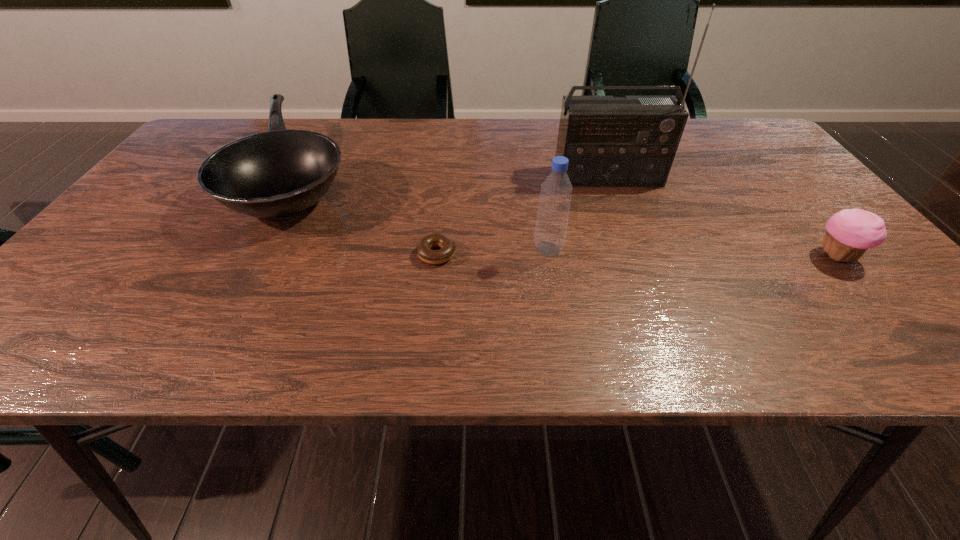
Identify which object is the third nearest to the third object from right to left. Please provide its 2D coordinates. Your answer should be formatted as a tuple, i.e. [(x, y)], where the tuple contains the x and y coordinates of a point satisfying the conditions above.

[(280, 173)]

Identify the location of free spot that satisfies the following two spatial constraints: 1. on the front side of the cupcake; 2. on the left side of the doughnut. (436, 256).

Identify the location of vacant space that satisfies the following two spatial constraints: 1. on the front side of the leftmost object; 2. on the left side of the rightmost object. (256, 256).

What are the coordinates of `free location that satisfies the following two spatial constraints: 1. on the front side of the leftmost object; 2. on the right side of the second tallest object` in the screenshot? It's located at (260, 249).